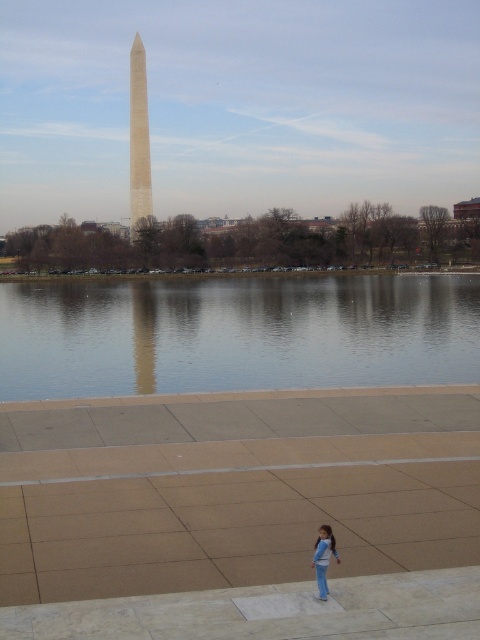
You are standing at the center of the Reflecting Pool and want to take a photo of the smooth white obelisk at center. Which direction should you face to capture it in your camera?

You should face north to capture the smooth white obelisk at center in your camera.